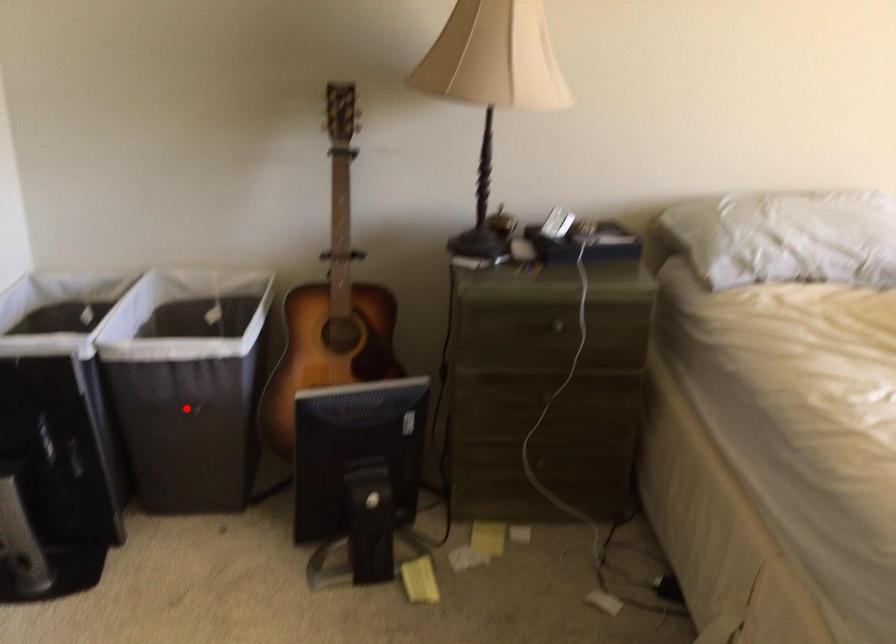
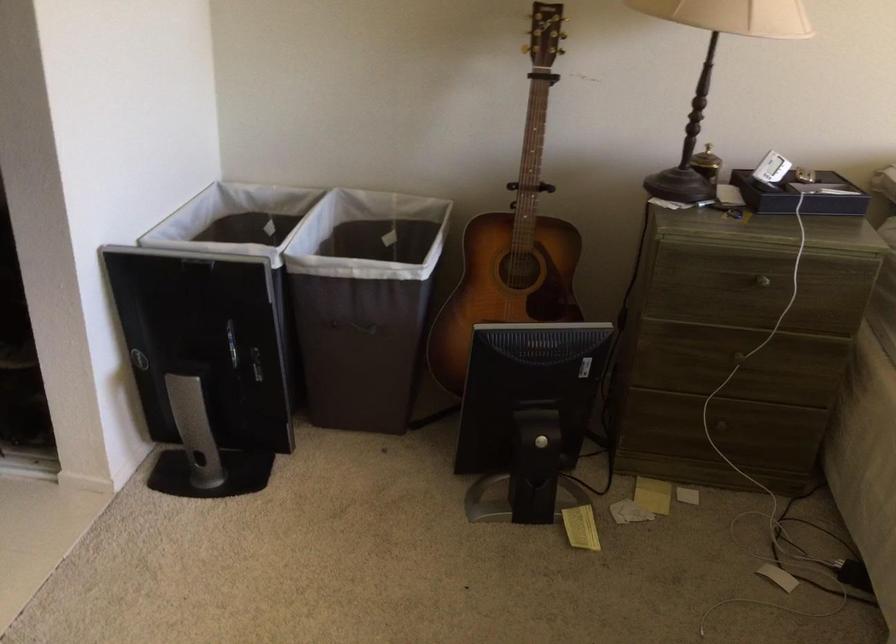
In the second image, find the point that corresponds to the highlighted location in the first image.

(357, 327)